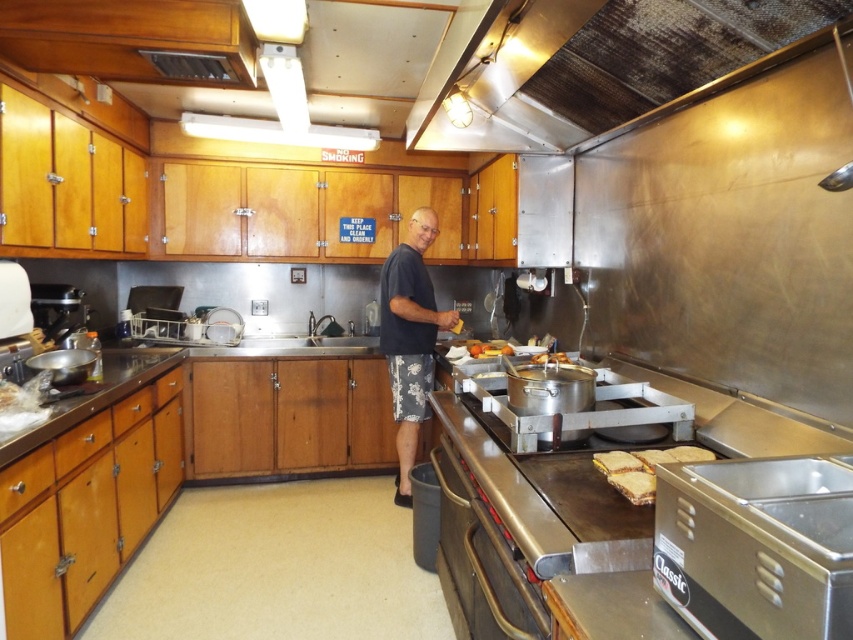
Question: Is metallic at upper center further to the viewer compared to slightly toasted bread at center?

Choices:
 (A) yes
 (B) no

Answer: (B)

Question: Which point is farther from the camera taking this photo?

Choices:
 (A) (616, 64)
 (B) (605, 454)
 (C) (698, 584)

Answer: (A)

Question: Among these points, which one is farthest from the camera?

Choices:
 (A) (259, 342)
 (B) (531, 381)

Answer: (A)

Question: Does dark blue t-shirt at center have a greater width compared to satin silver sink at center?

Choices:
 (A) yes
 (B) no

Answer: (B)

Question: Is stainless steel sandwich warmer at lower right to the right of stainless steel pot at center from the viewer's perspective?

Choices:
 (A) no
 (B) yes

Answer: (B)

Question: Which point appears closest to the camera in this image?

Choices:
 (A) (804, 470)
 (B) (540, 358)

Answer: (A)